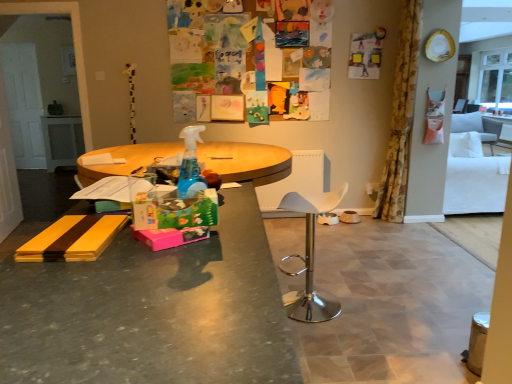
Question: Should I look upward or downward to see white plastic chair at center?

Choices:
 (A) up
 (B) down

Answer: (B)

Question: Can you confirm if white plastic chair at center is wider than white fabric couch at right?

Choices:
 (A) yes
 (B) no

Answer: (B)

Question: Can you confirm if white plastic chair at center is smaller than white fabric couch at right?

Choices:
 (A) yes
 (B) no

Answer: (A)

Question: Are white plastic chair at center and white fabric couch at right making contact?

Choices:
 (A) yes
 (B) no

Answer: (B)

Question: Is the depth of white plastic chair at center greater than that of white fabric couch at right?

Choices:
 (A) no
 (B) yes

Answer: (A)

Question: From a real-world perspective, is white plastic chair at center on top of white fabric couch at right?

Choices:
 (A) no
 (B) yes

Answer: (A)

Question: Is white plastic chair at center at the left side of white fabric couch at right?

Choices:
 (A) yes
 (B) no

Answer: (A)

Question: Does white fabric armchair at right, the 2th armchair viewed from the right, lie in front of white fabric couch at right?

Choices:
 (A) yes
 (B) no

Answer: (B)

Question: Is white fabric couch at right inside white fabric armchair at right, positioned as the 1th armchair in left-to-right order?

Choices:
 (A) yes
 (B) no

Answer: (B)

Question: Is white fabric armchair at right, acting as the second armchair starting from the back, thinner than white fabric couch at right?

Choices:
 (A) no
 (B) yes

Answer: (B)

Question: Is white fabric armchair at right, which is the first armchair from bottom to top, located outside white fabric couch at right?

Choices:
 (A) yes
 (B) no

Answer: (A)

Question: Is white fabric armchair at right, which is the first armchair from bottom to top, taller than white fabric couch at right?

Choices:
 (A) yes
 (B) no

Answer: (B)

Question: Is white fabric armchair at right, placed as the first armchair when sorted from front to back, looking in the opposite direction of white fabric couch at right?

Choices:
 (A) yes
 (B) no

Answer: (B)

Question: Considering the relative positions of matte gray desk at center and brown ceramic bowl at center, the 1th bowl when ordered from right to left, in the image provided, is matte gray desk at center to the right of brown ceramic bowl at center, the 1th bowl when ordered from right to left, from the viewer's perspective?

Choices:
 (A) yes
 (B) no

Answer: (B)